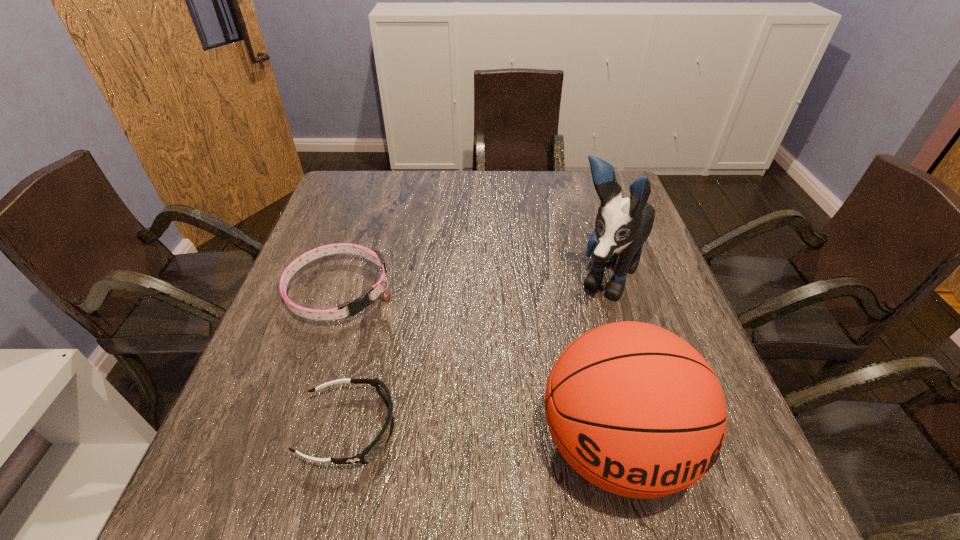
Locate an element on the screen. The height and width of the screenshot is (540, 960). the shortest object is located at coordinates (370, 452).

Where is `the second tallest object`? This screenshot has width=960, height=540. the second tallest object is located at coordinates click(634, 409).

Locate an element on the screen. dog collar is located at coordinates (357, 305).

Find the location of a particular element. puppy is located at coordinates (623, 224).

At what (x,y) coordinates should I click in order to perform the action: click on vacant space located on the front and sides of the shortest object. Please return your answer as a coordinate pair (x, y). This screenshot has width=960, height=540. Looking at the image, I should click on (534, 428).

Identify the location of vacant space positioned with the buckle on the dog collar. This screenshot has height=540, width=960. (438, 380).

Where is `vacant space located 0.300m with the buckle on the dog collar`? The image size is (960, 540). vacant space located 0.300m with the buckle on the dog collar is located at coordinates (462, 402).

Locate an element on the screen. This screenshot has width=960, height=540. free region located with the buckle on the dog collar is located at coordinates (438, 380).

The width and height of the screenshot is (960, 540). Identify the location of free space located on the front-facing side of the puppy. (560, 369).

I want to click on vacant space located on the front-facing side of the puppy, so click(540, 403).